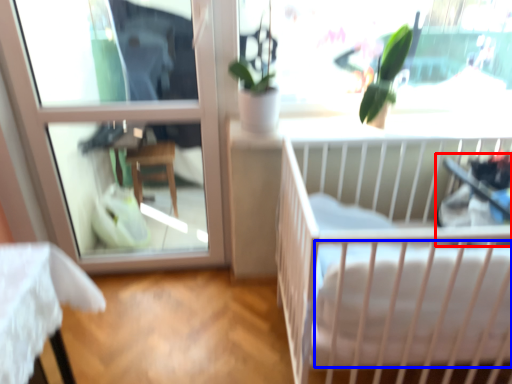
Question: Which object appears farthest to the camera in this image, baby carriage (highlighted by a red box) or mattress (highlighted by a blue box)?

Choices:
 (A) baby carriage
 (B) mattress

Answer: (A)